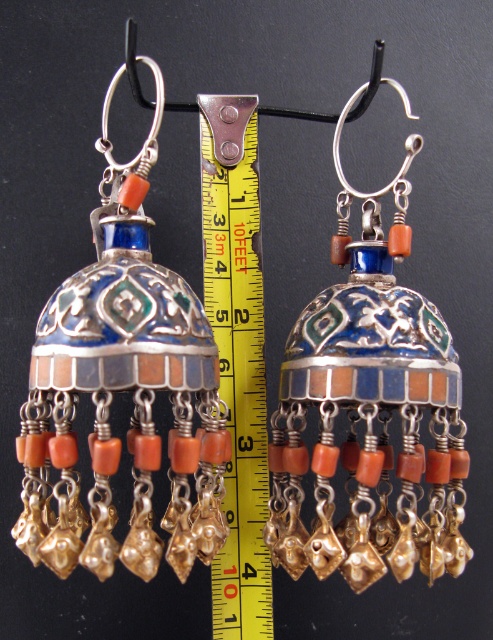
You are an appraiser examining the earrings displayed against a black background. The display stand has a metal hook from which the earrings hang. There is a yellow measuring tape placed vertically between them. To ensure proper documentation, you need to note the exact position of the enamel and silver earrings at center. Based on the coordinate provided, can you determine if the earrings are positioned to the right or left of the center point of the image?

The enamel and silver earrings at center are located at coordinate point 0.630 on the x and 0.755 on the y. Since the x coordinate is 0.630, which is greater than 0.5, the earrings are positioned to the right of the center point of the image.

You are an appraiser evaluating the placement of two points on an earring display. The points are labeled as point (454, 401) and point (245, 563). Which point is closer to the viewer?

Point (454, 401) is in front of point (245, 563), so it is closer to the viewer.